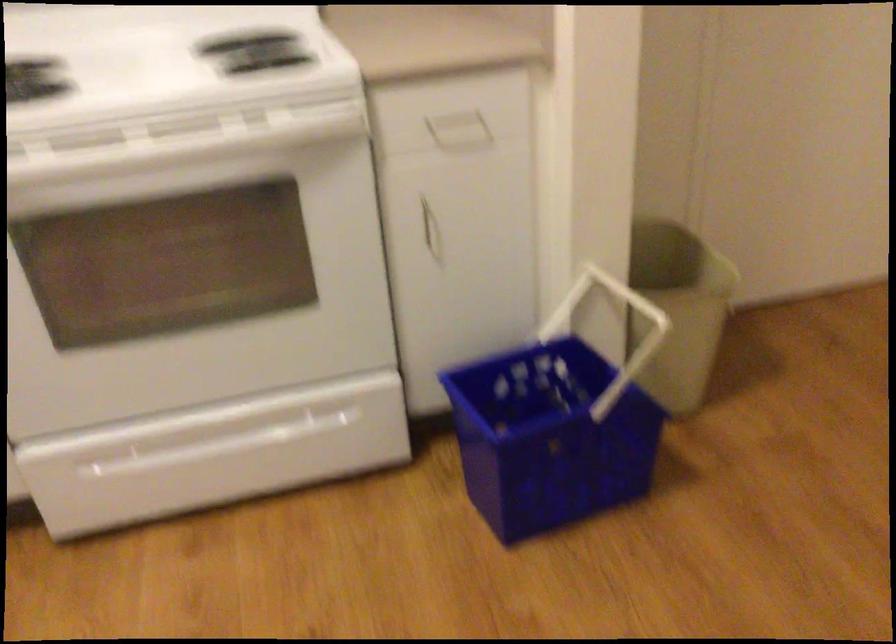
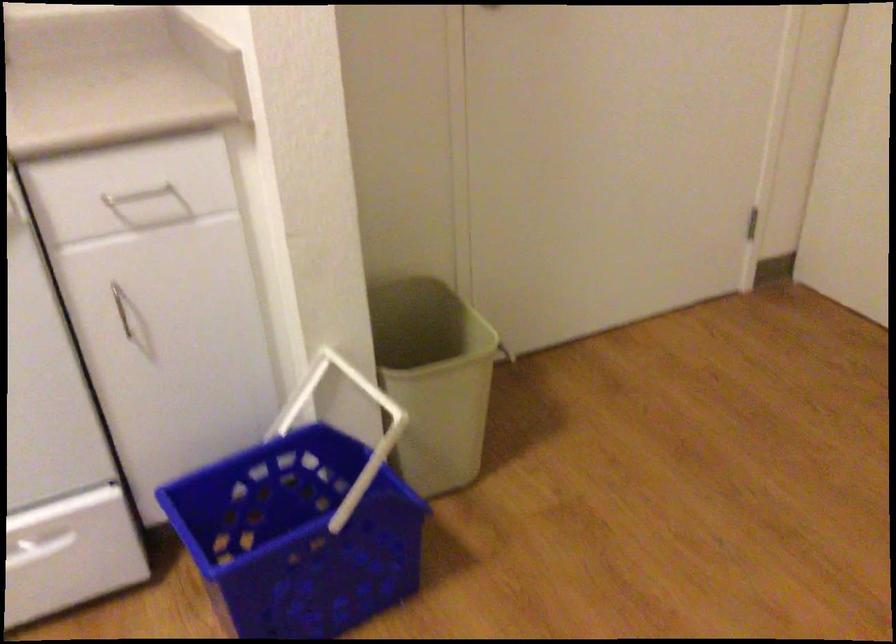
Question: How did the camera likely rotate?

Choices:
 (A) Left
 (B) Right
 (C) Up
 (D) Down

Answer: (B)